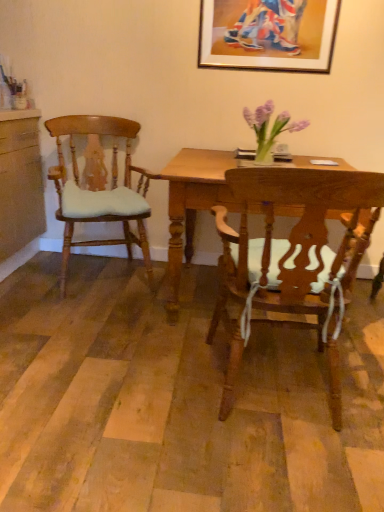
Question: Does wooden chair at center, marked as the 1th chair in a right-to-left arrangement, have a greater height compared to wooden picture frame at upper center?

Choices:
 (A) no
 (B) yes

Answer: (B)

Question: Is wooden picture frame at upper center surrounded by wooden chair at center, marked as the 1th chair in a right-to-left arrangement?

Choices:
 (A) yes
 (B) no

Answer: (B)

Question: Is wooden chair at center, placed as the second chair when sorted from left to right, in contact with wooden picture frame at upper center?

Choices:
 (A) no
 (B) yes

Answer: (A)

Question: Is wooden chair at center, the 1th chair when ordered from front to back, looking in the opposite direction of wooden picture frame at upper center?

Choices:
 (A) yes
 (B) no

Answer: (B)

Question: From a real-world perspective, is wooden chair at center, placed as the second chair when sorted from left to right, physically above wooden picture frame at upper center?

Choices:
 (A) no
 (B) yes

Answer: (A)

Question: Is wooden chair at center, arranged as the second chair when viewed from the back, shorter than wooden picture frame at upper center?

Choices:
 (A) yes
 (B) no

Answer: (B)

Question: From a real-world perspective, is wooden desk at center located beneath wooden picture frame at upper center?

Choices:
 (A) no
 (B) yes

Answer: (B)

Question: Is the depth of wooden desk at center less than that of wooden picture frame at upper center?

Choices:
 (A) yes
 (B) no

Answer: (A)

Question: Can you confirm if wooden desk at center is thinner than wooden picture frame at upper center?

Choices:
 (A) yes
 (B) no

Answer: (B)

Question: Is wooden desk at center in contact with wooden picture frame at upper center?

Choices:
 (A) yes
 (B) no

Answer: (B)

Question: Considering the relative sizes of wooden desk at center and wooden picture frame at upper center in the image provided, is wooden desk at center bigger than wooden picture frame at upper center?

Choices:
 (A) no
 (B) yes

Answer: (B)

Question: Considering the relative positions of wooden desk at center and wooden picture frame at upper center in the image provided, is wooden desk at center to the right of wooden picture frame at upper center from the viewer's perspective?

Choices:
 (A) no
 (B) yes

Answer: (A)

Question: From a real-world perspective, is wooden picture frame at upper center under wooden chair at center, placed as the second chair when sorted from left to right?

Choices:
 (A) no
 (B) yes

Answer: (A)